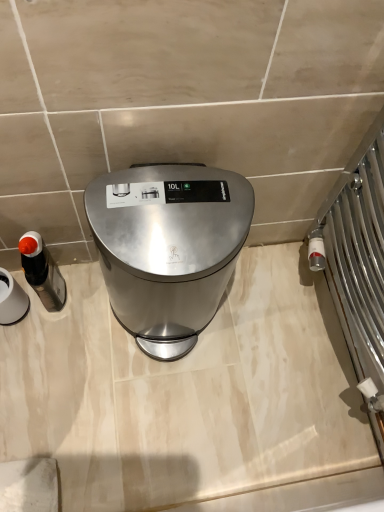
The height and width of the screenshot is (512, 384). Describe the element at coordinates (11, 298) in the screenshot. I see `matte black soap dispenser at left, which ranks as the second appliance in right-to-left order` at that location.

At what (x,y) coordinates should I click in order to perform the action: click on satin silver trash can at center. Please return your answer as a coordinate pair (x, y). Looking at the image, I should click on (168, 247).

At what (x,y) coordinates should I click in order to perform the action: click on matte black soap dispenser at left, which appears as the first appliance when viewed from the right. Please return your answer as a coordinate pair (x, y). The width and height of the screenshot is (384, 512). Looking at the image, I should click on (42, 271).

Is point (6, 315) in front of point (56, 301)?

Yes, point (6, 315) is closer to viewer.

From a real-world perspective, is matte black soap dispenser at left, the 1th appliance in the left-to-right sequence, over matte black soap dispenser at left, positioned as the 2th appliance in left-to-right order?

Yes, from a real-world perspective, matte black soap dispenser at left, the 1th appliance in the left-to-right sequence, is above matte black soap dispenser at left, positioned as the 2th appliance in left-to-right order.

Is matte black soap dispenser at left, which ranks as the second appliance in right-to-left order, looking in the opposite direction of matte black soap dispenser at left, positioned as the 2th appliance in left-to-right order?

No.

Is matte black soap dispenser at left, which appears as the first appliance when viewed from the right, located within matte black soap dispenser at left, which ranks as the second appliance in right-to-left order?

No, matte black soap dispenser at left, which appears as the first appliance when viewed from the right, is not inside matte black soap dispenser at left, which ranks as the second appliance in right-to-left order.

In the image, there is a matte black soap dispenser at left, which ranks as the second appliance in right-to-left order. At what (x,y) coordinates should I click in order to perform the action: click on appliance below it (from the image's perspective). Please return your answer as a coordinate pair (x, y). The height and width of the screenshot is (512, 384). Looking at the image, I should click on (42, 271).

From a real-world perspective, which object rests below the other?

From a 3D spatial view, matte black soap dispenser at left, which appears as the first appliance when viewed from the right, is below.

Is the surface of matte black soap dispenser at left, which appears as the first appliance when viewed from the right, in direct contact with matte black soap dispenser at left, which ranks as the second appliance in right-to-left order?

Yes, matte black soap dispenser at left, which appears as the first appliance when viewed from the right, is in contact with matte black soap dispenser at left, which ranks as the second appliance in right-to-left order.

Is matte black soap dispenser at left, which appears as the first appliance when viewed from the right, aimed at matte black soap dispenser at left, which ranks as the second appliance in right-to-left order?

No, matte black soap dispenser at left, which appears as the first appliance when viewed from the right, does not turn towards matte black soap dispenser at left, which ranks as the second appliance in right-to-left order.

How distant is satin silver trash can at center from matte black soap dispenser at left, which ranks as the second appliance in right-to-left order?

14.77 inches.

Is point (185, 180) farther from viewer compared to point (18, 298)?

No, (185, 180) is in front of (18, 298).

In terms of height, does satin silver trash can at center look taller or shorter compared to matte black soap dispenser at left, which ranks as the second appliance in right-to-left order?

Considering their sizes, satin silver trash can at center has more height than matte black soap dispenser at left, which ranks as the second appliance in right-to-left order.

Consider the image. From the image's perspective, which one is positioned higher, matte black soap dispenser at left, which appears as the first appliance when viewed from the right, or satin silver trash can at center?

satin silver trash can at center, from the image's perspective.

Consider the image. Is matte black soap dispenser at left, positioned as the 2th appliance in left-to-right order, positioned with its back to satin silver trash can at center?

No, satin silver trash can at center is not at the back of matte black soap dispenser at left, positioned as the 2th appliance in left-to-right order.

Is satin silver trash can at center looking in the opposite direction of matte black soap dispenser at left, positioned as the 2th appliance in left-to-right order?

No, satin silver trash can at center's orientation is not away from matte black soap dispenser at left, positioned as the 2th appliance in left-to-right order.

Is satin silver trash can at center situated inside matte black soap dispenser at left, which appears as the first appliance when viewed from the right, or outside?

satin silver trash can at center is spatially situated outside matte black soap dispenser at left, which appears as the first appliance when viewed from the right.

Is the position of satin silver trash can at center less distant than that of matte black soap dispenser at left, which appears as the first appliance when viewed from the right?

That is True.

From a real-world perspective, which object rests below the other?

matte black soap dispenser at left, which appears as the first appliance when viewed from the right.

Which object is wider, matte black soap dispenser at left, which ranks as the second appliance in right-to-left order, or satin silver trash can at center?

satin silver trash can at center is wider.

Considering the positions of points (15, 293) and (192, 199), is point (15, 293) closer to camera compared to point (192, 199)?

No.

Image resolution: width=384 pixels, height=512 pixels. Find the location of `home appliance in front of the matte black soap dispenser at left, which ranks as the second appliance in right-to-left order`. home appliance in front of the matte black soap dispenser at left, which ranks as the second appliance in right-to-left order is located at coordinates (168, 247).

From the image's perspective, is matte black soap dispenser at left, which ranks as the second appliance in right-to-left order, located beneath satin silver trash can at center?

Yes, from the image's perspective, matte black soap dispenser at left, which ranks as the second appliance in right-to-left order, is beneath satin silver trash can at center.

The image size is (384, 512). I want to click on appliance on the left of matte black soap dispenser at left, positioned as the 2th appliance in left-to-right order, so click(11, 298).

The image size is (384, 512). In the image, there is a matte black soap dispenser at left, positioned as the 2th appliance in left-to-right order. Identify the location of appliance above it (from the image's perspective). (11, 298).

Considering their positions, is satin silver trash can at center positioned closer to matte black soap dispenser at left, the 1th appliance in the left-to-right sequence, than matte black soap dispenser at left, positioned as the 2th appliance in left-to-right order?

matte black soap dispenser at left, positioned as the 2th appliance in left-to-right order.

Looking at this image, based on their spatial positions, is matte black soap dispenser at left, which ranks as the second appliance in right-to-left order, or matte black soap dispenser at left, positioned as the 2th appliance in left-to-right order, further from satin silver trash can at center?

matte black soap dispenser at left, which ranks as the second appliance in right-to-left order, is further to satin silver trash can at center.

Looking at the image, which one is located further to matte black soap dispenser at left, which appears as the first appliance when viewed from the right, matte black soap dispenser at left, which ranks as the second appliance in right-to-left order, or satin silver trash can at center?

satin silver trash can at center.

Consider the image. When comparing their distances from satin silver trash can at center, does matte black soap dispenser at left, positioned as the 2th appliance in left-to-right order, or matte black soap dispenser at left, which ranks as the second appliance in right-to-left order, seem further?

matte black soap dispenser at left, which ranks as the second appliance in right-to-left order, is positioned further to the anchor satin silver trash can at center.

Based on their spatial positions, is matte black soap dispenser at left, positioned as the 2th appliance in left-to-right order, or satin silver trash can at center further from matte black soap dispenser at left, which ranks as the second appliance in right-to-left order?

Based on the image, satin silver trash can at center appears to be further to matte black soap dispenser at left, which ranks as the second appliance in right-to-left order.

Based on their spatial positions, is satin silver trash can at center or matte black soap dispenser at left, the 1th appliance in the left-to-right sequence, closer to matte black soap dispenser at left, positioned as the 2th appliance in left-to-right order?

matte black soap dispenser at left, the 1th appliance in the left-to-right sequence.

Locate an element on the screen. appliance between matte black soap dispenser at left, which ranks as the second appliance in right-to-left order, and satin silver trash can at center from left to right is located at coordinates (42, 271).